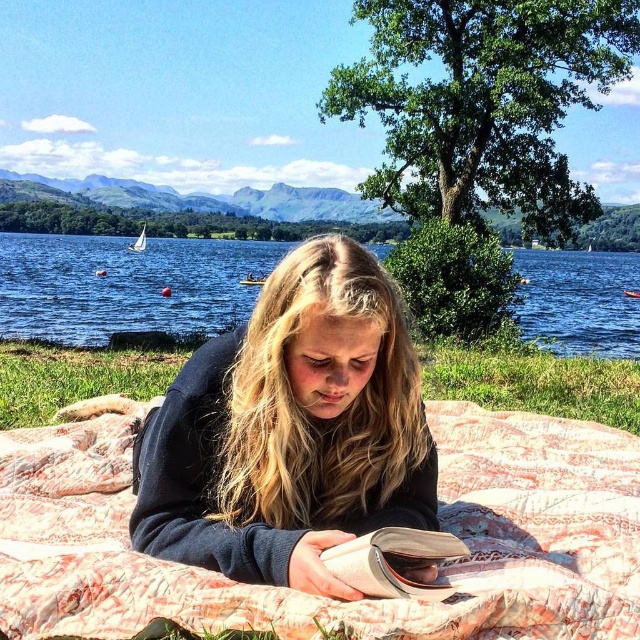
You are a photographer trying to capture the person reading on the pink quilted blanket at center and the green grass at center. Which object is closer to the camera?

The pink quilted blanket at center is closer to the camera because it is in front of the green grass at center.

You are a photographer holding a camera 5.26 feet away from the pink quilted blanket at center where the person is lying. You want to capture a wide shot that includes both the blanket and the distant mountains. Do you think you can step back to get a better composition without moving the camera? Explain your reasoning.

The camera is already 5.26 feet away from the pink quilted blanket at center. Since the photographer wants to capture a wide shot including the distant mountains, stepping back would allow a wider angle to include more of the background, so yes, stepping back is possible and advisable to achieve the desired composition.

You are planning to take a nap in the serene outdoor scene described. You want to lie down on the pink quilted blanket at center. Based on the coordinates provided, can you confirm if the point marked by point (323, 596) is the correct location for the blanket?

Yes, the pink quilted blanket at center is represented by point (323, 596), so the coordinates indicate the correct location for the blanket.